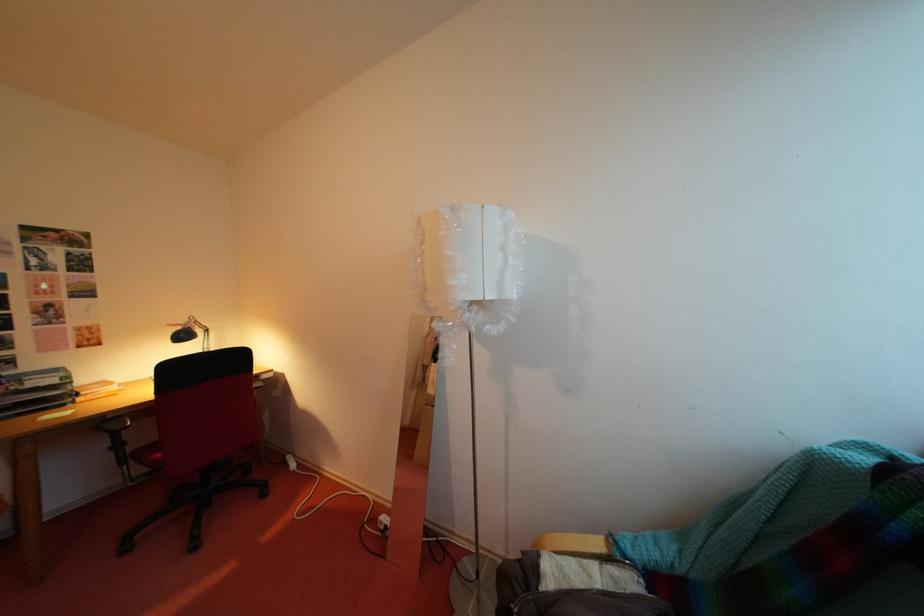
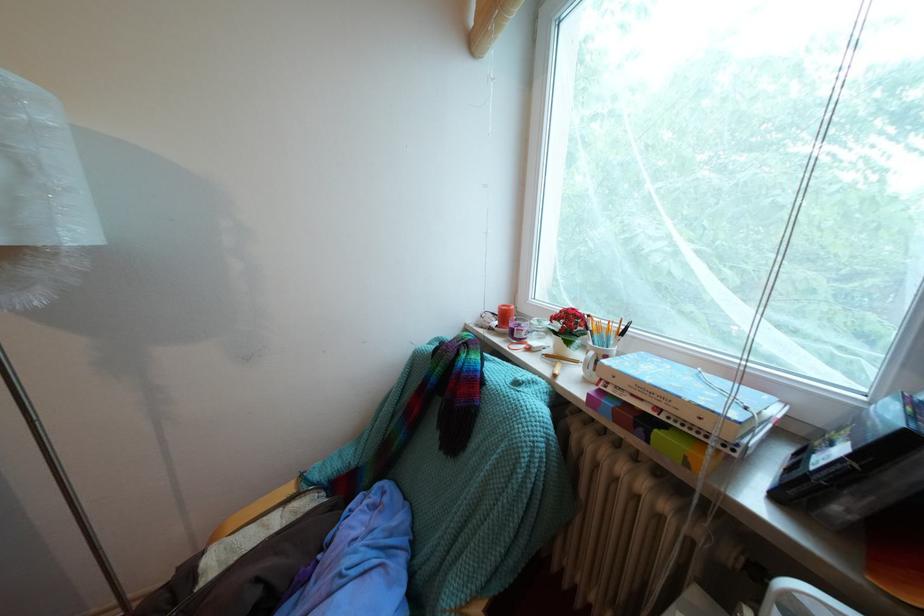
Question: How did the camera likely rotate?

Choices:
 (A) Left
 (B) Right
 (C) Up
 (D) Down

Answer: (B)